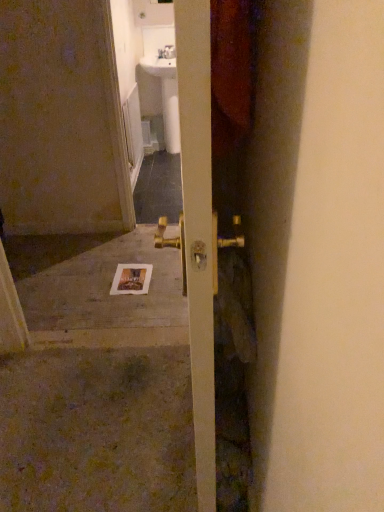
Find the location of a particular element. The image size is (384, 512). vacant area on top of white concrete at center (from a real-world perspective) is located at coordinates (95, 280).